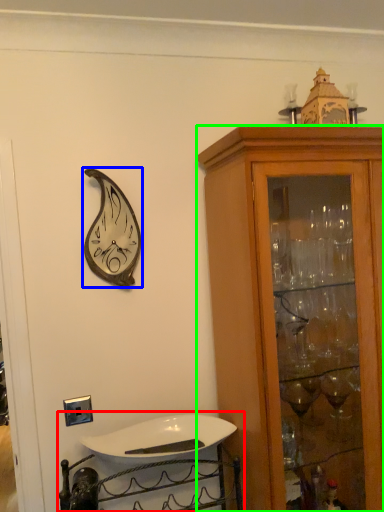
Question: Which object is positioned closest to sink (highlighted by a red box)? Select from clock (highlighted by a blue box) and cabinetry (highlighted by a green box).

Choices:
 (A) clock
 (B) cabinetry

Answer: (B)